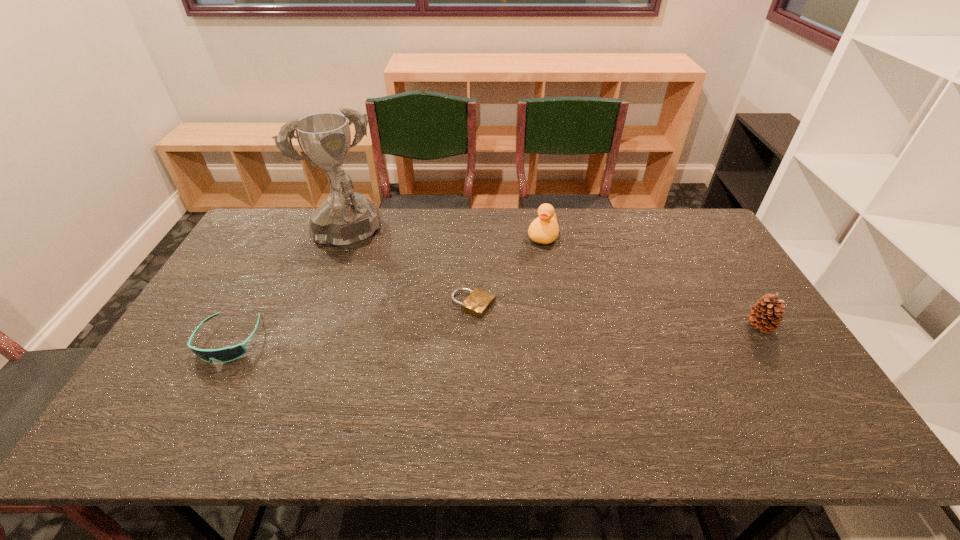
At what (x,y) coordinates should I click in order to perform the action: click on vacant space located on the side with emblem of the award. Please return your answer as a coordinate pair (x, y). The width and height of the screenshot is (960, 540). Looking at the image, I should click on (406, 324).

At what (x,y) coordinates should I click in order to perform the action: click on free region located on the side with emblem of the award. Please return your answer as a coordinate pair (x, y). This screenshot has width=960, height=540. Looking at the image, I should click on (364, 270).

Find the location of a particular element. The height and width of the screenshot is (540, 960). vacant space situated 0.090m on the side with emblem of the award is located at coordinates (370, 277).

You are a GUI agent. You are given a task and a screenshot of the screen. Output one action in this format:
    pyautogui.click(x=<x>, y=<y>)
    Task: Click on the free space located 0.400m on the keyhole side of the third object from left to right
    Image resolution: width=960 pixels, height=540 pixels.
    Given the screenshot: What is the action you would take?
    (x=632, y=372)

Find the location of a particular element. free space located on the keyhole side of the third object from left to right is located at coordinates (609, 362).

This screenshot has height=540, width=960. I want to click on vacant space situated on the keyhole side of the third object from left to right, so click(558, 340).

At what (x,y) coordinates should I click in order to perform the action: click on vacant region located on the face of the fourth object from left to right. Please return your answer as a coordinate pair (x, y). Looking at the image, I should click on (531, 276).

Image resolution: width=960 pixels, height=540 pixels. I want to click on free space located on the face of the fourth object from left to right, so tap(534, 266).

At what (x,y) coordinates should I click in order to perform the action: click on free location located 0.290m on the face of the fourth object from left to right. Please return your answer as a coordinate pair (x, y). This screenshot has height=540, width=960. Looking at the image, I should click on (520, 307).

Find the location of a particular element. The image size is (960, 540). award present at the far edge is located at coordinates (346, 219).